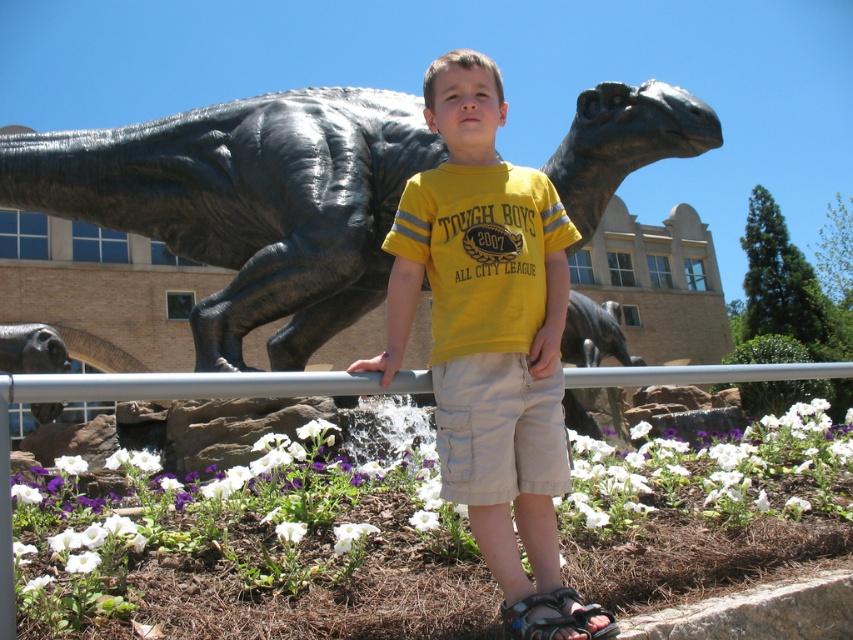
Who is more forward, (38, 362) or (537, 628)?

Point (537, 628) is more forward.

Based on the photo, does shiny black statue at lower left appear under black synthetic sandal at lower center?

No.

The width and height of the screenshot is (853, 640). What are the coordinates of `shiny black statue at lower left` in the screenshot? It's located at (32, 349).

Where is `shiny black statue at lower left`? shiny black statue at lower left is located at coordinates click(x=32, y=349).

Is yellow cotton shirt at center smaller than black synthetic sandal at lower center?

No.

Who is positioned more to the left, yellow cotton shirt at center or black synthetic sandal at lower center?

From the viewer's perspective, yellow cotton shirt at center appears more on the left side.

Is point (410, 196) positioned after point (532, 624)?

Yes.

You are a GUI agent. You are given a task and a screenshot of the screen. Output one action in this format:
    pyautogui.click(x=<x>, y=<y>)
    Task: Click on the yellow cotton shirt at center
    This screenshot has height=640, width=853.
    Given the screenshot: What is the action you would take?
    pyautogui.click(x=489, y=330)

Is black polished statue at upper center in front of black synthetic sandal at lower center?

No, black polished statue at upper center is behind black synthetic sandal at lower center.

Between black polished statue at upper center and black synthetic sandal at lower center, which one appears on the left side from the viewer's perspective?

black polished statue at upper center

What are the coordinates of `black polished statue at upper center` in the screenshot? It's located at (247, 204).